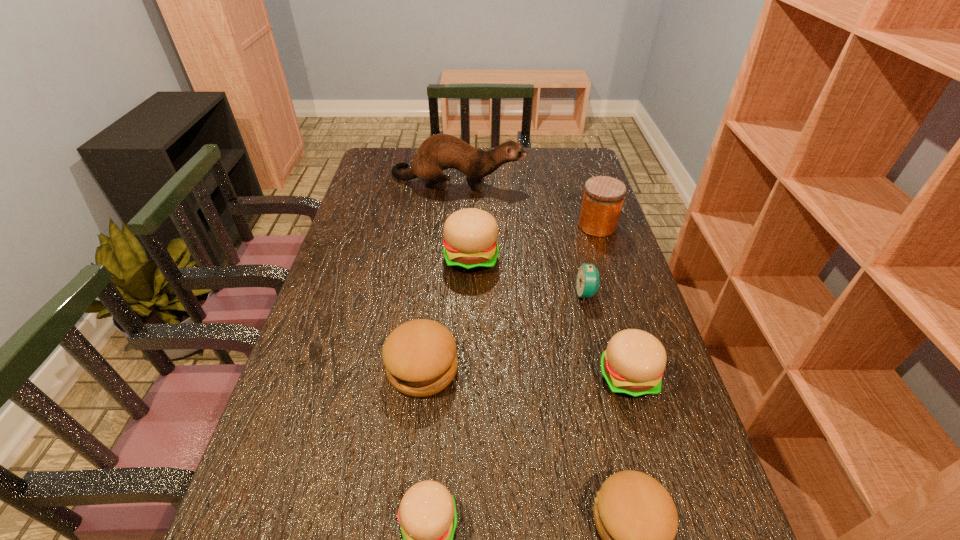
At what (x,y) coordinates should I click in order to perform the action: click on object present at the far edge. Please return your answer as a coordinate pair (x, y). This screenshot has width=960, height=540. Looking at the image, I should click on (438, 152).

At what (x,y) coordinates should I click in order to perform the action: click on object present at the left edge. Please return your answer as a coordinate pair (x, y). This screenshot has width=960, height=540. Looking at the image, I should click on (438, 152).

Find the location of a particular element. The width and height of the screenshot is (960, 540). jar that is at the right edge is located at coordinates (603, 197).

Locate an element on the screen. The image size is (960, 540). hamburger at the right edge is located at coordinates tap(632, 365).

At what (x,y) coordinates should I click in order to perform the action: click on alarm clock at the right edge. Please return your answer as a coordinate pair (x, y). Looking at the image, I should click on (587, 279).

This screenshot has height=540, width=960. In order to click on object at the far left corner in this screenshot , I will do `click(438, 152)`.

I want to click on free space at the far edge of the desktop, so click(482, 149).

At what (x,y) coordinates should I click in order to perform the action: click on blank space at the left edge. Please return your answer as a coordinate pair (x, y). Looking at the image, I should click on (331, 381).

Where is `vacant area at the right edge of the desktop`? The width and height of the screenshot is (960, 540). vacant area at the right edge of the desktop is located at coordinates (619, 306).

At what (x,y) coordinates should I click in order to perform the action: click on vacant space at the far right corner of the desktop. Please return your answer as a coordinate pair (x, y). This screenshot has height=540, width=960. Looking at the image, I should click on (571, 153).